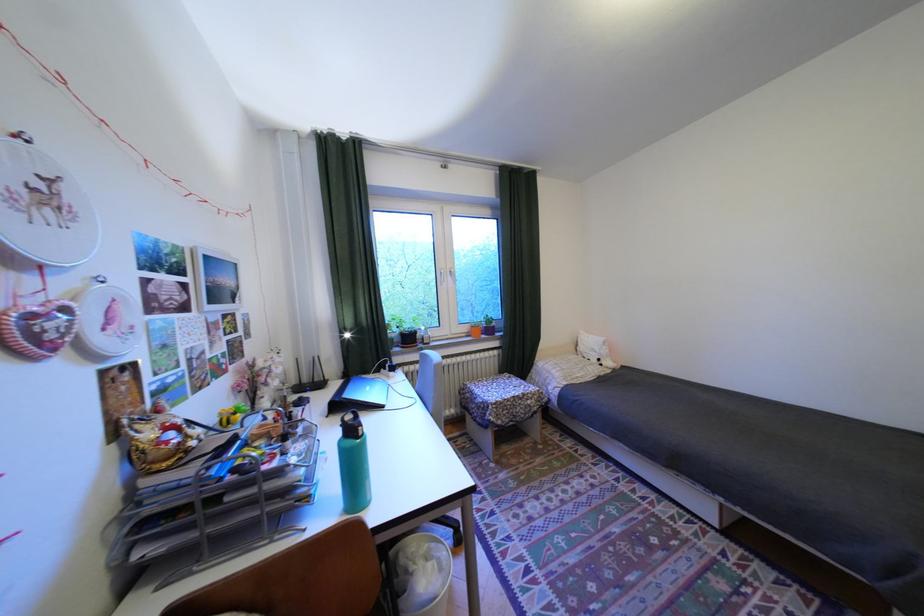
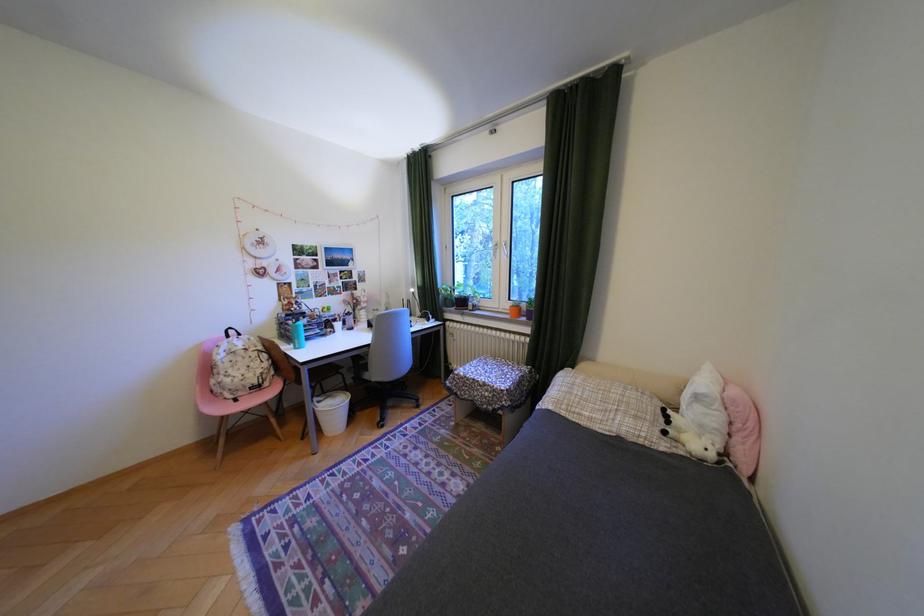
Find the pixel in the second image that matches point (613, 365) in the first image.

(676, 432)